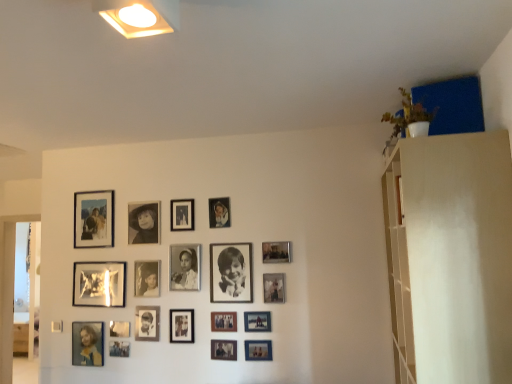
Consider the image. What is the approximate height of metallic silver photo frame at lower center, positioned as the seventeenth picture frame in left-to-right order?

metallic silver photo frame at lower center, positioned as the seventeenth picture frame in left-to-right order, is 5.15 inches in height.

In order to click on matte black photo frame at upper left, marked as the eighteenth picture frame in a right-to-left arrangement in this screenshot , I will do `click(94, 219)`.

Locate an element on the screen. This screenshot has width=512, height=384. metallic silver photo frame at upper center, the 12th picture frame when ordered from left to right is located at coordinates (219, 212).

What is the approximate height of matte silver picture frame at center, placed as the 16th picture frame when sorted from left to right?

5.15 inches.

Image resolution: width=512 pixels, height=384 pixels. Find the location of `matte silver picture frame at center, placed as the 16th picture frame when sorted from left to right`. matte silver picture frame at center, placed as the 16th picture frame when sorted from left to right is located at coordinates (257, 321).

Image resolution: width=512 pixels, height=384 pixels. Find the location of `metallic silver photo frame at lower center, positioned as the seventeenth picture frame in left-to-right order`. metallic silver photo frame at lower center, positioned as the seventeenth picture frame in left-to-right order is located at coordinates (258, 350).

From the image's perspective, relative to metallic silver photo frame at upper center, the eighth picture frame in the right-to-left sequence, is black matte photo frame at upper center, positioned as the sixth picture frame in left-to-right order, above or below?

From the image's perspective, black matte photo frame at upper center, positioned as the sixth picture frame in left-to-right order, appears below metallic silver photo frame at upper center, the eighth picture frame in the right-to-left sequence.

Is black matte photo frame at upper center, positioned as the sixth picture frame in left-to-right order, turned away from metallic silver photo frame at upper center, the eighth picture frame in the right-to-left sequence?

No, black matte photo frame at upper center, positioned as the sixth picture frame in left-to-right order, is not facing away from metallic silver photo frame at upper center, the eighth picture frame in the right-to-left sequence.

From a real-world perspective, who is located lower, black matte photo frame at upper center, positioned as the sixth picture frame in left-to-right order, or metallic silver photo frame at upper center, the 12th picture frame when ordered from left to right?

black matte photo frame at upper center, positioned as the sixth picture frame in left-to-right order, is physically lower.

Is point (129, 239) less distant than point (215, 213)?

No, (129, 239) is behind (215, 213).

Based on the photo, which is in front, metallic silver photo frame at center, acting as the 18th picture frame starting from the left, or black matte photo frame at center, the twelfth picture frame from the right?

metallic silver photo frame at center, acting as the 18th picture frame starting from the left, is closer to the camera.

Does metallic silver photo frame at center, acting as the 18th picture frame starting from the left, have a greater width compared to black matte photo frame at center, marked as the eighth picture frame in a left-to-right arrangement?

Yes.

From the picture: Can you confirm if metallic silver photo frame at center, the 2th picture frame positioned from the right, is positioned to the left of black matte photo frame at center, marked as the eighth picture frame in a left-to-right arrangement?

No.

Is there a large distance between metallic silver photo frame at center, acting as the 18th picture frame starting from the left, and black matte photo frame at center, marked as the eighth picture frame in a left-to-right arrangement?

Actually, metallic silver photo frame at center, acting as the 18th picture frame starting from the left, and black matte photo frame at center, marked as the eighth picture frame in a left-to-right arrangement, are a little close together.

Considering the relative sizes of black matte photo frame at center, marked as the eighth picture frame in a left-to-right arrangement, and metallic silver photo frame at center, acting as the tenth picture frame starting from the left, in the image provided, is black matte photo frame at center, marked as the eighth picture frame in a left-to-right arrangement, shorter than metallic silver photo frame at center, acting as the tenth picture frame starting from the left,?

In fact, black matte photo frame at center, marked as the eighth picture frame in a left-to-right arrangement, may be taller than metallic silver photo frame at center, acting as the tenth picture frame starting from the left.

Is black matte photo frame at center, the twelfth picture frame from the right, behind metallic silver photo frame at center, acting as the tenth picture frame starting from the left?

Yes, black matte photo frame at center, the twelfth picture frame from the right, is further from the viewer.

Would you consider black matte photo frame at center, the twelfth picture frame from the right, to be distant from metallic silver photo frame at center, placed as the tenth picture frame when sorted from right to left?

No, there isn't a large distance between black matte photo frame at center, the twelfth picture frame from the right, and metallic silver photo frame at center, placed as the tenth picture frame when sorted from right to left.

Can you confirm if metallic silver photo frame at center, the 2th picture frame positioned from the right, is bigger than black matte photo frame at upper center, positioned as the sixth picture frame in left-to-right order?

No.

Between metallic silver photo frame at center, acting as the 18th picture frame starting from the left, and black matte photo frame at upper center, positioned as the sixth picture frame in left-to-right order, which one has smaller width?

With smaller width is metallic silver photo frame at center, acting as the 18th picture frame starting from the left.

Is metallic silver photo frame at center, the 2th picture frame positioned from the right, further to the viewer compared to black matte photo frame at upper center, acting as the fourteenth picture frame starting from the right?

No, it is in front of black matte photo frame at upper center, acting as the fourteenth picture frame starting from the right.

From a real-world perspective, which object stands above the other?

black matte photo frame at upper center, acting as the fourteenth picture frame starting from the right.

Looking at this image, which is further, (x=224, y=350) or (x=211, y=313)?

The point (x=211, y=313) is behind.

Visually, is metallic silver photo frame at center, the 6th picture frame from the right, positioned to the left or to the right of matte black photo frame at center, acting as the seventh picture frame starting from the right?

metallic silver photo frame at center, the 6th picture frame from the right, is to the right of matte black photo frame at center, acting as the seventh picture frame starting from the right.

From a real-world perspective, is metallic silver photo frame at center, the 6th picture frame from the right, located beneath matte black photo frame at center, acting as the seventh picture frame starting from the right?

Yes, from a real-world perspective, metallic silver photo frame at center, the 6th picture frame from the right, is beneath matte black photo frame at center, acting as the seventh picture frame starting from the right.

Between metallic silver photo frame at center, which is the fourteenth picture frame in left-to-right order, and matte black photo frame at center, acting as the seventh picture frame starting from the right, which one has less height?

matte black photo frame at center, acting as the seventh picture frame starting from the right, is shorter.

Can you confirm if black matte photo frame at center, marked as the eighth picture frame in a left-to-right arrangement, is smaller than black matte photo frame at upper center, acting as the fourteenth picture frame starting from the right?

Indeed, black matte photo frame at center, marked as the eighth picture frame in a left-to-right arrangement, has a smaller size compared to black matte photo frame at upper center, acting as the fourteenth picture frame starting from the right.

Does black matte photo frame at center, the twelfth picture frame from the right, appear on the left side of black matte photo frame at upper center, acting as the fourteenth picture frame starting from the right?

No.

Is black matte photo frame at center, marked as the eighth picture frame in a left-to-right arrangement, not inside black matte photo frame at upper center, positioned as the sixth picture frame in left-to-right order?

That's correct, black matte photo frame at center, marked as the eighth picture frame in a left-to-right arrangement, is outside of black matte photo frame at upper center, positioned as the sixth picture frame in left-to-right order.

From a real-world perspective, is black matte photo frame at center, marked as the eighth picture frame in a left-to-right arrangement, positioned over black matte photo frame at upper center, acting as the fourteenth picture frame starting from the right, based on gravity?

Incorrect, from a real-world perspective, black matte photo frame at center, marked as the eighth picture frame in a left-to-right arrangement, is lower than black matte photo frame at upper center, acting as the fourteenth picture frame starting from the right.

Is matte black photo frame at upper left, marked as the eighteenth picture frame in a right-to-left arrangement, looking in the opposite direction of metallic silver photo frame at center, acting as the tenth picture frame starting from the left?

No.

Is there a large distance between matte black photo frame at upper left, the second picture frame viewed from the left, and metallic silver photo frame at center, placed as the tenth picture frame when sorted from right to left?

Actually, matte black photo frame at upper left, the second picture frame viewed from the left, and metallic silver photo frame at center, placed as the tenth picture frame when sorted from right to left, are a little close together.

Can you tell me how much matte black photo frame at upper left, the second picture frame viewed from the left, and metallic silver photo frame at center, placed as the tenth picture frame when sorted from right to left, differ in facing direction?

The angle between the facing direction of matte black photo frame at upper left, the second picture frame viewed from the left, and the facing direction of metallic silver photo frame at center, placed as the tenth picture frame when sorted from right to left, is 0.518 degrees.

From a real-world perspective, between matte black photo frame at upper left, the second picture frame viewed from the left, and metallic silver photo frame at center, acting as the tenth picture frame starting from the left, who is vertically lower?

metallic silver photo frame at center, acting as the tenth picture frame starting from the left, from a real-world perspective.

From a real-world perspective, starting from the metallic silver photo frame at upper center, the eighth picture frame in the right-to-left sequence, which picture frame is the 3rd one below it? Please provide its 2D coordinates.

[(144, 222)]

Locate an element on the screen. This screenshot has height=384, width=512. the 10th picture frame to the left of the metallic silver photo frame at center, the 2th picture frame positioned from the right, counting from the anchor's position is located at coordinates (147, 323).

Looking at the image, which one is located closer to metallic silver photo frame at center, placed as the tenth picture frame when sorted from right to left, metallic silver photo frame at center, which is the fourteenth picture frame in left-to-right order, or metallic silver photo frame at center, the 2th picture frame positioned from the right?

metallic silver photo frame at center, which is the fourteenth picture frame in left-to-right order.

Which object lies nearer to the anchor point metallic silver photo frame at lower center, positioned as the seventeenth picture frame in left-to-right order, matte black photo frame at upper left, the second picture frame viewed from the left, or matte black photo frame at center, acting as the seventh picture frame starting from the right?

matte black photo frame at center, acting as the seventh picture frame starting from the right, is positioned closer to the anchor metallic silver photo frame at lower center, positioned as the seventeenth picture frame in left-to-right order.

From the image, which object appears to be farther from black matte photo frame at center, acting as the ninth picture frame starting from the right, metallic silver picture frame at center, acting as the 4th picture frame starting from the left, or metallic silver photo frame at center, the 1th picture frame from the right?

metallic silver photo frame at center, the 1th picture frame from the right, lies further to black matte photo frame at center, acting as the ninth picture frame starting from the right, than the other object.

Considering their positions, is matte black photo frame at upper left, the second picture frame viewed from the left, positioned further to white matte shelf at upper right than metallic silver photo frame at center, the 19th picture frame viewed from the left?

matte black photo frame at upper left, the second picture frame viewed from the left, is positioned further to the anchor white matte shelf at upper right.

Looking at the image, which one is located further to matte black picture frame at upper center, the 9th picture frame in the left-to-right sequence, black matte photo frame at upper center, positioned as the sixth picture frame in left-to-right order, or metallic silver photo frame at center, the 19th picture frame viewed from the left?

metallic silver photo frame at center, the 19th picture frame viewed from the left, lies further to matte black picture frame at upper center, the 9th picture frame in the left-to-right sequence, than the other object.

Considering their positions, is metallic silver photo frame at lower center, which is the 15th picture frame from right to left, positioned closer to black matte picture frame at center, acting as the fifteenth picture frame starting from the left, than metallic silver photo frame at center, acting as the tenth picture frame starting from the left?

metallic silver photo frame at center, acting as the tenth picture frame starting from the left.

Considering their positions, is black matte photo frame at upper center, acting as the fourteenth picture frame starting from the right, positioned further to matte black photo frame at upper left, the second picture frame viewed from the left, than metallic silver photo frame at upper center, the 12th picture frame when ordered from left to right?

Among the two, metallic silver photo frame at upper center, the 12th picture frame when ordered from left to right, is located further to matte black photo frame at upper left, the second picture frame viewed from the left.

Based on their spatial positions, is metallic silver photo frame at center, the 19th picture frame viewed from the left, or black matte photo frame at center, which ranks as the eleventh picture frame in left-to-right order, closer to black matte photo frame at center, arranged as the thirteenth picture frame when viewed from the right?

black matte photo frame at center, which ranks as the eleventh picture frame in left-to-right order, is positioned closer to the anchor black matte photo frame at center, arranged as the thirteenth picture frame when viewed from the right.

You are a GUI agent. You are given a task and a screenshot of the screen. Output one action in this format:
    pyautogui.click(x=<x>, y=<y>)
    Task: Click on the picture frame located between white matte shelf at upper right and metallic silver photo frame at center, the 2th picture frame positioned from the right, in the depth direction
    This screenshot has height=384, width=512.
    Given the screenshot: What is the action you would take?
    pyautogui.click(x=258, y=350)